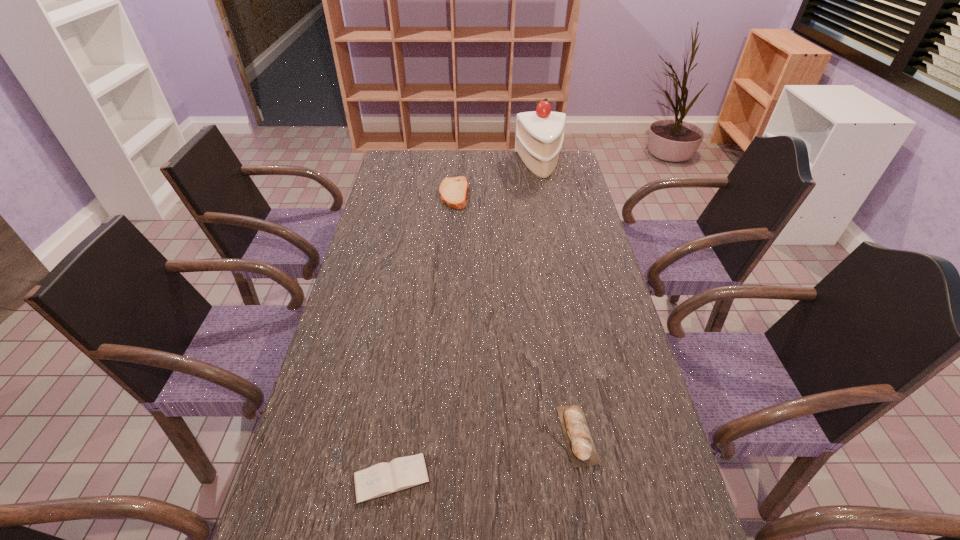
Where is `cake`? This screenshot has height=540, width=960. cake is located at coordinates (539, 137).

The image size is (960, 540). Find the location of `the farther pita bread`. the farther pita bread is located at coordinates (453, 191).

Where is `the right pita bread`? Image resolution: width=960 pixels, height=540 pixels. the right pita bread is located at coordinates (578, 438).

Image resolution: width=960 pixels, height=540 pixels. Identify the location of the shortest object. tap(382, 479).

Where is `vacant space located 0.130m on the left of the cake`? This screenshot has width=960, height=540. vacant space located 0.130m on the left of the cake is located at coordinates (486, 164).

You are a GUI agent. You are given a task and a screenshot of the screen. Output one action in this format:
    pyautogui.click(x=<x>, y=<y>)
    Task: Click on the blank space located 0.350m on the front of the left pita bread
    
    Given the screenshot: What is the action you would take?
    pyautogui.click(x=447, y=275)

Identify the location of free spot located 0.350m on the left of the nearer pita bread. (401, 435).

At what (x,y) coordinates should I click in order to perform the action: click on vacant space situated 0.150m on the right of the shortest object. Please return your answer as a coordinate pair (x, y). Looking at the image, I should click on point(504,478).

The image size is (960, 540). I want to click on object that is at the far edge, so click(539, 137).

I want to click on object that is at the left edge, so click(382, 479).